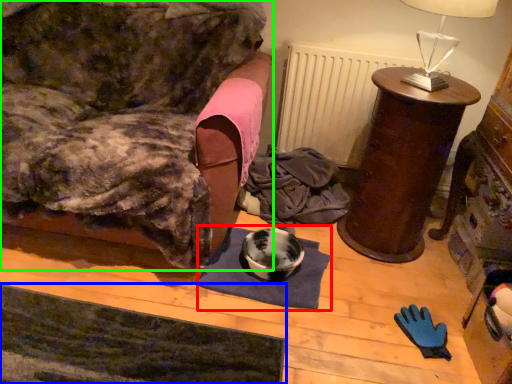
Question: Which is nearer to the mat (highlighted by a red box)? yoga mat (highlighted by a blue box) or furniture (highlighted by a green box).

Choices:
 (A) yoga mat
 (B) furniture

Answer: (A)